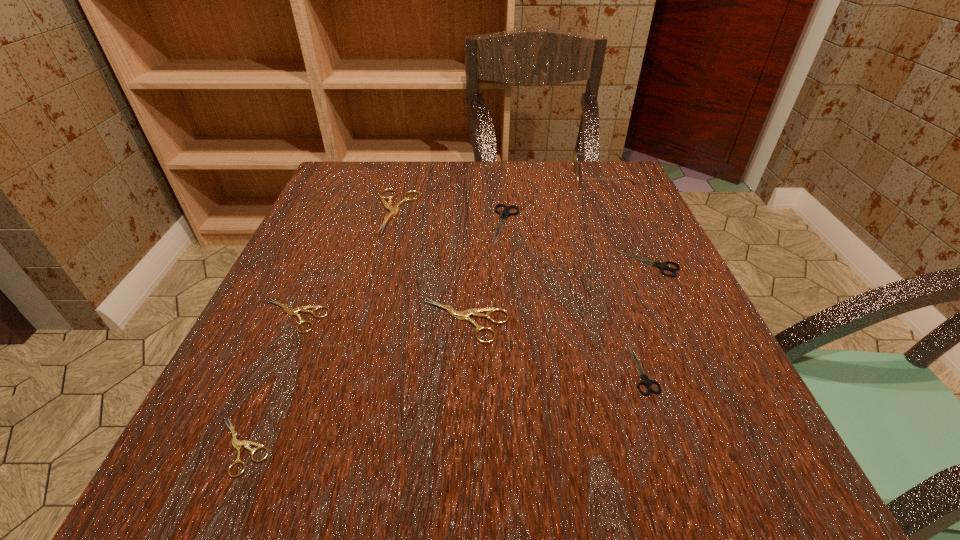
Find the location of a particular element. This screenshot has height=540, width=960. shears identified as the closest to the second black shears from left to right is located at coordinates (662, 266).

The height and width of the screenshot is (540, 960). Identify the location of the closest black shears relative to the third biggest beige shears. (504, 214).

Where is `black shears that is the second closest to the green sunglasses`? black shears that is the second closest to the green sunglasses is located at coordinates (662, 266).

I want to click on beige shears that is the third closest to the second biggest beige shears, so click(237, 444).

Where is `beige shears that is the closest to the second nearest black shears`? beige shears that is the closest to the second nearest black shears is located at coordinates (475, 312).

Find the location of a particular element. blank space that satisfies the following two spatial constraints: 1. on the front side of the leftmost black shears; 2. on the right side of the third shears from left to right is located at coordinates (394, 225).

Locate an element on the screen. The width and height of the screenshot is (960, 540). free point that satisfies the following two spatial constraints: 1. on the front side of the fifth shears from right to left; 2. on the left side of the smallest black shears is located at coordinates (355, 369).